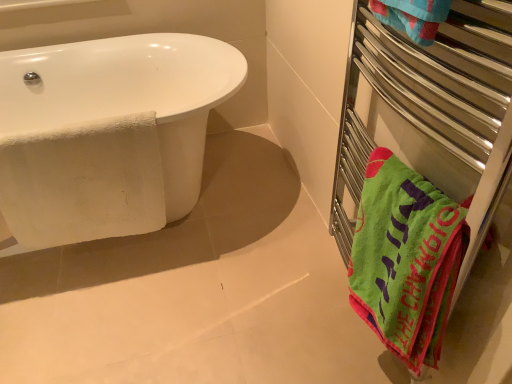
Where is `unoccupied area in front of white glossy bathtub at left`? The height and width of the screenshot is (384, 512). unoccupied area in front of white glossy bathtub at left is located at coordinates (139, 318).